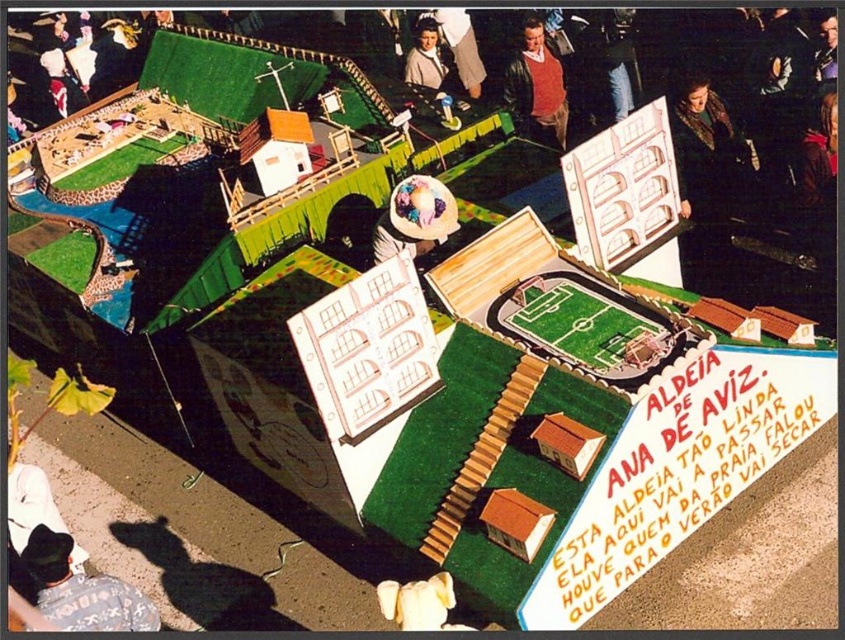
Does leather jacket at upper center lie behind white straw hat at center?

That is True.

Is point (533, 44) positioned behind point (410, 237)?

Yes.

Which is behind, point (521, 58) or point (431, 211)?

The point (521, 58) is behind.

The height and width of the screenshot is (640, 845). Identify the location of leather jacket at upper center. (537, 88).

Is white straw hat at center above matte brown leather jacket at upper center?

No, white straw hat at center is not above matte brown leather jacket at upper center.

Which is more to the left, white straw hat at center or matte brown leather jacket at upper center?

Positioned to the left is white straw hat at center.

Does point (424, 220) come farther from viewer compared to point (467, 61)?

No, it is not.

Where is `white straw hat at center`? The width and height of the screenshot is (845, 640). white straw hat at center is located at coordinates (415, 218).

Does black cotton shirt at lower left appear over matte white hat at upper center?

Actually, black cotton shirt at lower left is below matte white hat at upper center.

Can you confirm if black cotton shirt at lower left is thinner than matte white hat at upper center?

No, black cotton shirt at lower left is not thinner than matte white hat at upper center.

The height and width of the screenshot is (640, 845). Describe the element at coordinates (82, 589) in the screenshot. I see `black cotton shirt at lower left` at that location.

Where is `black cotton shirt at lower left`? This screenshot has height=640, width=845. black cotton shirt at lower left is located at coordinates (82, 589).